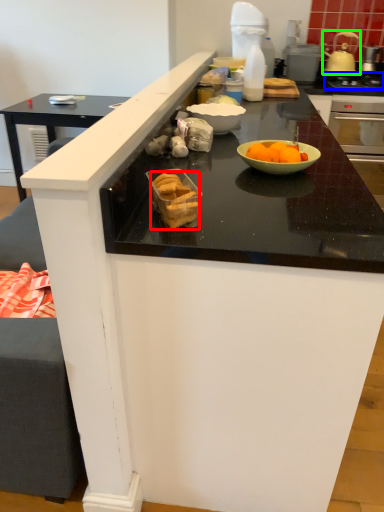
Question: Considering the real-world distances, which object is farthest from food (highlighted by a red box)? gas stove (highlighted by a blue box) or kitchen appliance (highlighted by a green box)?

Choices:
 (A) gas stove
 (B) kitchen appliance

Answer: (B)